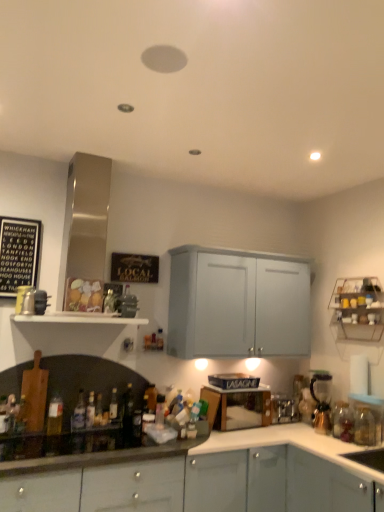
Describe the element at coordinates (204, 477) in the screenshot. This screenshot has width=384, height=512. I see `matte gray cabinets at lower right, acting as the 2th cabinetry starting from the right` at that location.

Image resolution: width=384 pixels, height=512 pixels. What do you see at coordinates (346, 422) in the screenshot?
I see `translucent glass bottle at lower right, the 10th bottle viewed from the left` at bounding box center [346, 422].

What do you see at coordinates (98, 410) in the screenshot? The image size is (384, 512). I see `translucent glass bottle at lower left, which ranks as the 5th bottle in right-to-left order` at bounding box center [98, 410].

The image size is (384, 512). Describe the element at coordinates (160, 410) in the screenshot. I see `translucent glass bottle at lower center, the 9th bottle viewed from the left` at that location.

Describe the element at coordinates (11, 412) in the screenshot. I see `translucent glass bottle at lower left, the tenth bottle positioned from the right` at that location.

How much space does translucent glass bottle at lower left, the tenth bottle positioned from the right, occupy vertically?

It is 8.84 inches.

Describe the element at coordinates (90, 411) in the screenshot. The height and width of the screenshot is (512, 384). I see `translucent glass bottle at lower left, the 6th bottle from the right` at that location.

Locate an element on the screen. This screenshot has width=384, height=512. matte gray cabinets at lower right, acting as the 2th cabinetry starting from the right is located at coordinates (204, 477).

Locate an element on the screen. The width and height of the screenshot is (384, 512). cabinetry located in front of the shiny glass bottles at lower left is located at coordinates (204, 477).

In the scene shown: Could you measure the distance between matte gray cabinets at lower right, positioned as the 1th cabinetry in left-to-right order, and shiny glass bottles at lower left?

The distance of matte gray cabinets at lower right, positioned as the 1th cabinetry in left-to-right order, from shiny glass bottles at lower left is 11.28 inches.

Looking at this image, how many degrees apart are the facing directions of matte gray cabinets at lower right, positioned as the 1th cabinetry in left-to-right order, and shiny glass bottles at lower left?

matte gray cabinets at lower right, positioned as the 1th cabinetry in left-to-right order, and shiny glass bottles at lower left are facing 0.978 degrees away from each other.

From a real-world perspective, who is located lower, matte gray cabinets at lower right, positioned as the 1th cabinetry in left-to-right order, or shiny glass bottles at lower left?

matte gray cabinets at lower right, positioned as the 1th cabinetry in left-to-right order.

Can you confirm if translucent glass bottle at lower left, the 6th bottle from the right, is smaller than translucent glass bottle at lower left, the third bottle when ordered from left to right?

Correct, translucent glass bottle at lower left, the 6th bottle from the right, occupies less space than translucent glass bottle at lower left, the third bottle when ordered from left to right.

Is translucent glass bottle at lower left, the 6th bottle from the right, oriented towards translucent glass bottle at lower left, the third bottle when ordered from left to right?

No, translucent glass bottle at lower left, the 6th bottle from the right, is not turned towards translucent glass bottle at lower left, the third bottle when ordered from left to right.

How many degrees apart are the facing directions of translucent glass bottle at lower left, the 5th bottle from the left, and translucent glass bottle at lower left, the third bottle when ordered from left to right?

They differ by 45 degrees in their facing directions.

Looking at this image, measure the distance between translucent glass bottle at lower left, the 6th bottle from the right, and translucent glass bottle at lower left, the third bottle when ordered from left to right.

A distance of 19.41 centimeters exists between translucent glass bottle at lower left, the 6th bottle from the right, and translucent glass bottle at lower left, the third bottle when ordered from left to right.

Which is in front, translucent glass bottle at lower left, which is counted as the first bottle, starting from the left, or metallic stainless steel toaster oven at lower center, the second appliance from the top?

Positioned in front is translucent glass bottle at lower left, which is counted as the first bottle, starting from the left.

Considering the relative positions of translucent glass bottle at lower left, the tenth bottle positioned from the right, and metallic stainless steel toaster oven at lower center, which appears as the second appliance when viewed from the left, in the image provided, is translucent glass bottle at lower left, the tenth bottle positioned from the right, to the left or to the right of metallic stainless steel toaster oven at lower center, which appears as the second appliance when viewed from the left,?

translucent glass bottle at lower left, the tenth bottle positioned from the right, is positioned on metallic stainless steel toaster oven at lower center, which appears as the second appliance when viewed from the left,'s left side.

Is translucent glass bottle at lower left, the tenth bottle positioned from the right, facing towards metallic stainless steel toaster oven at lower center, which appears as the second appliance when viewed from the left?

No, translucent glass bottle at lower left, the tenth bottle positioned from the right, is not turned towards metallic stainless steel toaster oven at lower center, which appears as the second appliance when viewed from the left.

From the image's perspective, is translucent glass bottle at lower left, the tenth bottle positioned from the right, located above metallic stainless steel toaster oven at lower center, acting as the first appliance starting from the right?

Correct, translucent glass bottle at lower left, the tenth bottle positioned from the right, appears higher than metallic stainless steel toaster oven at lower center, acting as the first appliance starting from the right, in the image.

From a real-world perspective, which object rests below the other?

white glossy cabinet at lower right, acting as the second cabinetry starting from the left, is physically lower.

Is white glossy cabinet at lower right, acting as the second cabinetry starting from the left, beside metallic stainless steel toaster oven at lower center, which appears as the second appliance when viewed from the left?

white glossy cabinet at lower right, acting as the second cabinetry starting from the left, is not next to metallic stainless steel toaster oven at lower center, which appears as the second appliance when viewed from the left, and they're not touching.

Can you confirm if white glossy cabinet at lower right, the first cabinetry when ordered from right to left, is thinner than metallic stainless steel toaster oven at lower center, acting as the first appliance starting from the bottom?

In fact, white glossy cabinet at lower right, the first cabinetry when ordered from right to left, might be wider than metallic stainless steel toaster oven at lower center, acting as the first appliance starting from the bottom.

Can you confirm if white glossy cabinet at lower right, acting as the second cabinetry starting from the left, is shorter than metallic stainless steel toaster oven at lower center, acting as the first appliance starting from the right?

No.

Between white glossy cabinet at lower right, the first cabinetry when ordered from right to left, and translucent glass bottle at lower right, positioned as the 1th bottle in right-to-left order, which one has larger width?

With larger width is white glossy cabinet at lower right, the first cabinetry when ordered from right to left.

Can you confirm if white glossy cabinet at lower right, acting as the second cabinetry starting from the left, is taller than translucent glass bottle at lower right, the 10th bottle viewed from the left?

Correct, white glossy cabinet at lower right, acting as the second cabinetry starting from the left, is much taller as translucent glass bottle at lower right, the 10th bottle viewed from the left.

Which is more to the right, white glossy cabinet at lower right, the first cabinetry when ordered from right to left, or translucent glass bottle at lower right, positioned as the 1th bottle in right-to-left order?

From the viewer's perspective, white glossy cabinet at lower right, the first cabinetry when ordered from right to left, appears more on the right side.

From a real-world perspective, is white glossy cabinet at lower right, the first cabinetry when ordered from right to left, located higher than translucent glass bottle at lower right, the 10th bottle viewed from the left?

No, from a real-world perspective, white glossy cabinet at lower right, the first cabinetry when ordered from right to left, is not on top of translucent glass bottle at lower right, the 10th bottle viewed from the left.

Is translucent glass bottle at lower left, positioned as the sixth bottle in left-to-right order, far from translucent glass bottle at lower center, the second bottle viewed from the right?

translucent glass bottle at lower left, positioned as the sixth bottle in left-to-right order, is near translucent glass bottle at lower center, the second bottle viewed from the right, not far away.

How many degrees apart are the facing directions of translucent glass bottle at lower left, which ranks as the 5th bottle in right-to-left order, and translucent glass bottle at lower center, the 9th bottle viewed from the left?

They differ by 3.82 degrees in their facing directions.

Between translucent glass bottle at lower left, positioned as the sixth bottle in left-to-right order, and translucent glass bottle at lower center, the 9th bottle viewed from the left, which one has larger size?

Bigger between the two is translucent glass bottle at lower center, the 9th bottle viewed from the left.

Image resolution: width=384 pixels, height=512 pixels. I want to click on the 7th bottle positioned above the translucent glass bottle at lower left, positioned as the sixth bottle in left-to-right order (from a real-world perspective), so click(160, 410).

Which point is more distant from viewer, (293, 418) or (34, 467)?

Positioned behind is point (293, 418).

Is metallic stainless steel toaster oven at lower center, acting as the first appliance starting from the bottom, inside or outside of shiny glass bottles at lower left?

The correct answer is: outside.

Is metallic stainless steel toaster oven at lower center, the first appliance in the back-to-front sequence, aimed at shiny glass bottles at lower left?

No, metallic stainless steel toaster oven at lower center, the first appliance in the back-to-front sequence, is not oriented towards shiny glass bottles at lower left.

Locate an element on the screen. This screenshot has height=512, width=384. countertop that appears on the left of matte gray cabinets at lower right, positioned as the 1th cabinetry in left-to-right order is located at coordinates (105, 455).

You are a GUI agent. You are given a task and a screenshot of the screen. Output one action in this format:
    pyautogui.click(x=<x>, y=<y>)
    Task: Click on the 3rd bottle located above the translucent glass bottle at lower left, the 5th bottle from the left (from a real-world perspective)
    
    Given the screenshot: What is the action you would take?
    pyautogui.click(x=55, y=415)

Considering their positions, is black matte signboard at upper left positioned further to shiny glass bottles at lower left than white glossy cabinet at lower right, acting as the second cabinetry starting from the left?

Among the two, black matte signboard at upper left is located further to shiny glass bottles at lower left.

Which object lies nearer to the anchor point shiny glass bottles at lower left, black matte signboard at upper left or translucent glass bottle at lower left, positioned as the sixth bottle in left-to-right order?

translucent glass bottle at lower left, positioned as the sixth bottle in left-to-right order, lies closer to shiny glass bottles at lower left than the other object.

Looking at the image, which one is located closer to translucent glass bottle at lower left, which is the eighth bottle in right-to-left order, white matte shelf at center, which is counted as the second shelf, starting from the right, or gold metallic coffee machine at right?

Among the two, white matte shelf at center, which is counted as the second shelf, starting from the right, is located nearer to translucent glass bottle at lower left, which is the eighth bottle in right-to-left order.

When comparing their distances from translucent glass bottle at lower left, the third bottle when ordered from left to right, does translucent glass bottle at lower right, the 10th bottle viewed from the left, or translucent glass bottle at left, the 2th bottle positioned from the left, seem closer?

translucent glass bottle at left, the 2th bottle positioned from the left, is positioned closer to the anchor translucent glass bottle at lower left, the third bottle when ordered from left to right.

Estimate the real-world distances between objects in this image. Which object is further from white glossy cabinet at lower right, the first cabinetry when ordered from right to left, translucent glass bottle at lower center, the second bottle viewed from the right, or translucent glass bottle at lower left, which is counted as the first bottle, starting from the left?

translucent glass bottle at lower left, which is counted as the first bottle, starting from the left, lies further to white glossy cabinet at lower right, the first cabinetry when ordered from right to left, than the other object.

Estimate the real-world distances between objects in this image. Which object is further from translucent glass bottle at lower left, positioned as the sixth bottle in left-to-right order, gold metallic coffee machine at right or translucent glass bottle at lower left, which is the eighth bottle in right-to-left order?

gold metallic coffee machine at right.

Estimate the real-world distances between objects in this image. Which object is closer to matte gray cabinets at lower right, acting as the 2th cabinetry starting from the right, translucent glass bottle at left, which appears as the 9th bottle when viewed from the right, or white glossy cabinet at lower right, the first cabinetry when ordered from right to left?

Based on the image, white glossy cabinet at lower right, the first cabinetry when ordered from right to left, appears to be nearer to matte gray cabinets at lower right, acting as the 2th cabinetry starting from the right.

Considering their positions, is metallic stainless steel toaster oven at lower center, acting as the first appliance starting from the bottom, positioned closer to black matte signboard at upper left than translucent glass bottle at lower center, the second bottle viewed from the right?

translucent glass bottle at lower center, the second bottle viewed from the right, is closer to black matte signboard at upper left.

Where is `cabinetry located between matte gray cabinets at lower right, positioned as the 1th cabinetry in left-to-right order, and metallic wire rack at upper right, arranged as the first shelf when viewed from the right, in the left-right direction`? The height and width of the screenshot is (512, 384). cabinetry located between matte gray cabinets at lower right, positioned as the 1th cabinetry in left-to-right order, and metallic wire rack at upper right, arranged as the first shelf when viewed from the right, in the left-right direction is located at coordinates (349, 490).

Find the location of a particular element. This screenshot has height=512, width=384. appliance between translucent glass bottle at lower left, which ranks as the 5th bottle in right-to-left order, and white glossy cabinet at lower right, the first cabinetry when ordered from right to left is located at coordinates (283, 410).

Locate an element on the screen. The height and width of the screenshot is (512, 384). coffee machine located between black matte signboard at upper left and white glossy cabinet at lower right, the first cabinetry when ordered from right to left, in the left-right direction is located at coordinates (321, 406).

Identify the location of coffee machine situated between translucent glass bottle at lower left, which is counted as the first bottle, starting from the left, and translucent glass bottle at lower right, the 10th bottle viewed from the left, from left to right. (321, 406).